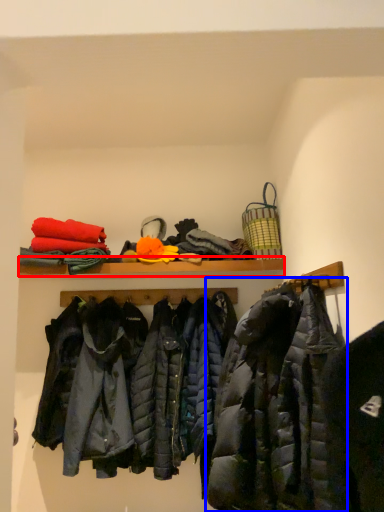
Question: Which point is closer to the camera, shelf (highlighted by a red box) or jacket (highlighted by a blue box)?

Choices:
 (A) shelf
 (B) jacket

Answer: (B)